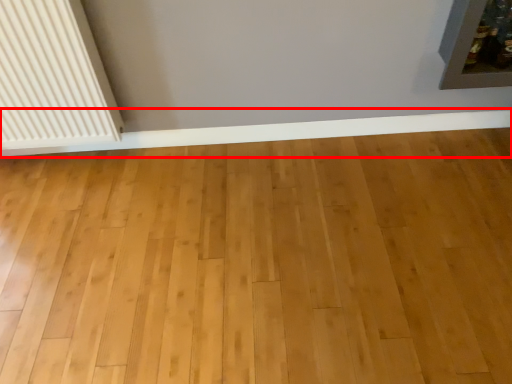
Question: From the image's perspective, what is the correct spatial positioning of ledge (annotated by the red box) in reference to radiator?

Choices:
 (A) below
 (B) above

Answer: (A)